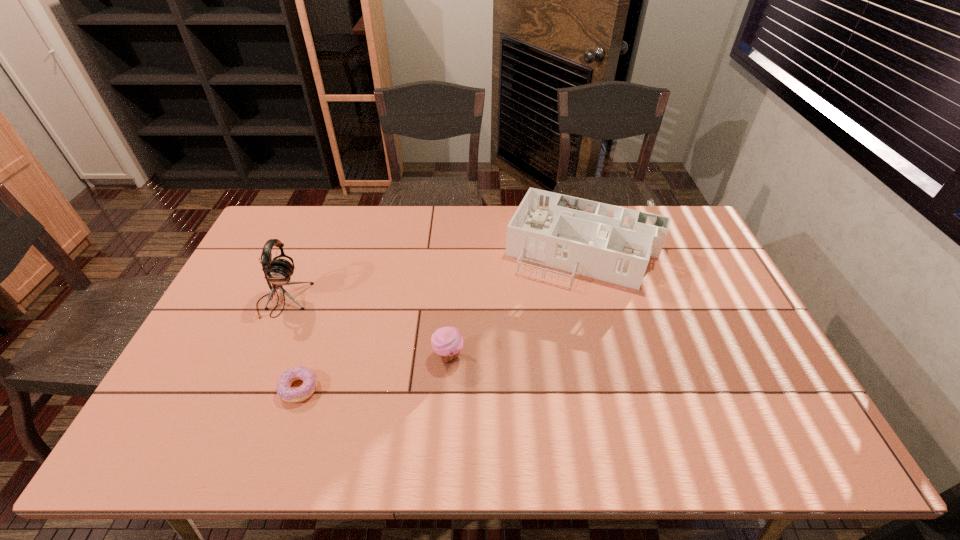
In the image, there is a desktop. Where is `free space at the far right corner`? This screenshot has height=540, width=960. free space at the far right corner is located at coordinates (691, 226).

The width and height of the screenshot is (960, 540). I want to click on blank space at the near right corner, so click(768, 428).

Image resolution: width=960 pixels, height=540 pixels. I want to click on free space between the third farthest object and the earphone, so click(x=366, y=328).

Locate an element on the screen. The width and height of the screenshot is (960, 540). free space between the earphone and the shortest object is located at coordinates (291, 344).

The image size is (960, 540). I want to click on unoccupied position between the shortest object and the leftmost object, so click(291, 344).

Where is `free area in between the doughnut and the second nearest object`? free area in between the doughnut and the second nearest object is located at coordinates click(x=373, y=372).

You are a GUI agent. You are given a task and a screenshot of the screen. Output one action in this format:
    pyautogui.click(x=<x>, y=<y>)
    Task: Click on the unoccupied area between the third object from left to right and the leftmost object
    This screenshot has height=540, width=960.
    Given the screenshot: What is the action you would take?
    pyautogui.click(x=366, y=328)

Image resolution: width=960 pixels, height=540 pixels. I want to click on vacant area that lies between the rightmost object and the leftmost object, so click(x=433, y=275).

Find the location of a particular element. This screenshot has height=540, width=960. free space between the cupcake and the second tallest object is located at coordinates (516, 302).

At what (x,y) coordinates should I click in order to perform the action: click on blank region between the rightmost object and the third object from left to right. Please return your answer as a coordinate pair (x, y). This screenshot has width=960, height=540. Looking at the image, I should click on (516, 302).